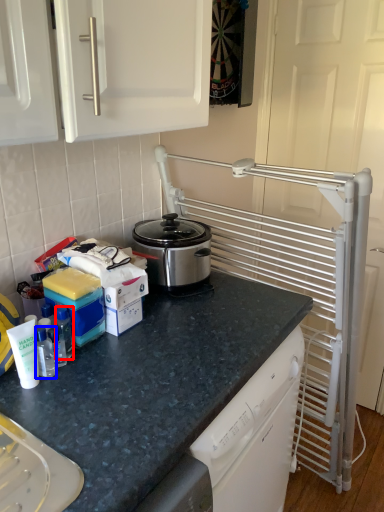
Question: Among these objects, which one is nearest to the camera, bottle (highlighted by a red box) or bottle (highlighted by a blue box)?

Choices:
 (A) bottle
 (B) bottle

Answer: (B)